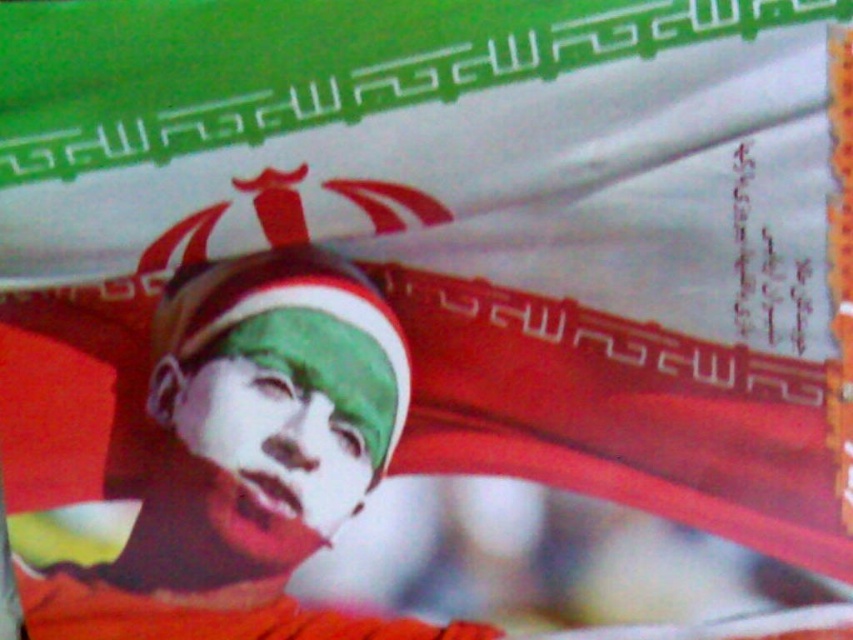
Question: Which object appears closest to the camera in this image?

Choices:
 (A) matte green cap at center
 (B) green matte face at center

Answer: (A)

Question: Is matte green cap at center positioned at the back of green matte face at center?

Choices:
 (A) yes
 (B) no

Answer: (B)

Question: Does matte green cap at center have a smaller size compared to green matte face at center?

Choices:
 (A) yes
 (B) no

Answer: (B)

Question: Observing the image, what is the correct spatial positioning of matte green cap at center in reference to green matte face at center?

Choices:
 (A) right
 (B) left

Answer: (B)